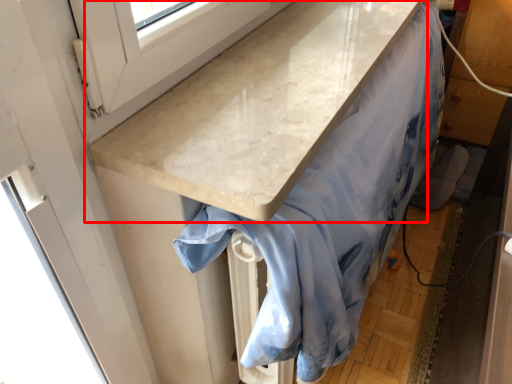
Question: Observing the image, what is the correct spatial positioning of countertop (annotated by the red box) in reference to fabric?

Choices:
 (A) left
 (B) right

Answer: (A)